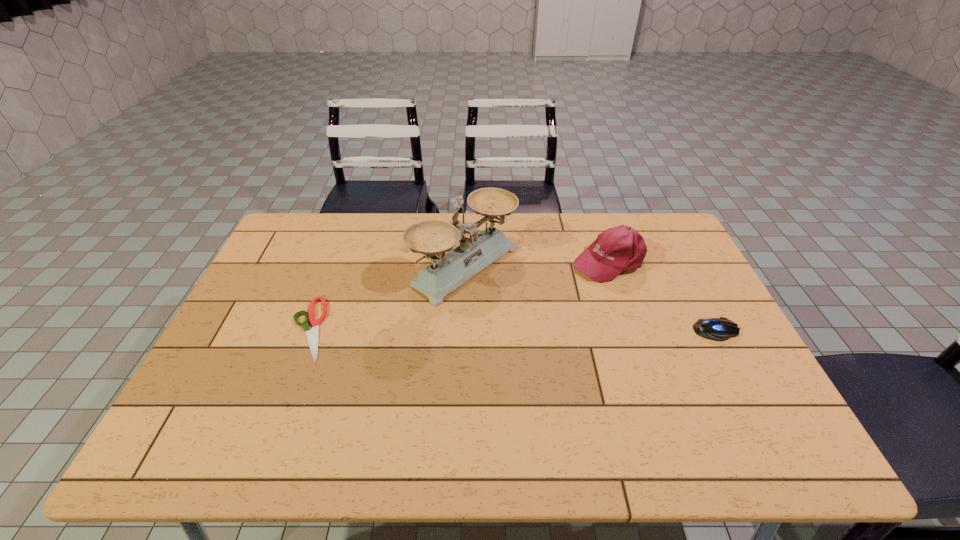
Locate an element on the screen. This screenshot has height=540, width=960. free spot that satisfies the following two spatial constraints: 1. on the front side of the scale; 2. on the button side of the rightmost object is located at coordinates (465, 330).

You are a GUI agent. You are given a task and a screenshot of the screen. Output one action in this format:
    pyautogui.click(x=<x>, y=<y>)
    Task: Click on the free location that satisfies the following two spatial constraints: 1. on the back side of the leftmost object; 2. on the right side of the third shortest object
    
    Given the screenshot: What is the action you would take?
    pyautogui.click(x=335, y=260)

Where is `free space that satisfies the following two spatial constraints: 1. on the front side of the rightmost object; 2. on the button side of the scale`? free space that satisfies the following two spatial constraints: 1. on the front side of the rightmost object; 2. on the button side of the scale is located at coordinates (465, 330).

You are a GUI agent. You are given a task and a screenshot of the screen. Output one action in this format:
    pyautogui.click(x=<x>, y=<y>)
    Task: Click on the vacant area that satisfies the following two spatial constraints: 1. on the front side of the baseball cap; 2. on the button side of the computer mouse
    The height and width of the screenshot is (540, 960).
    Given the screenshot: What is the action you would take?
    [631, 330]

Where is `vacant space that satisfies the following two spatial constraints: 1. on the front side of the scissors; 2. on the button side of the third tallest object`? This screenshot has height=540, width=960. vacant space that satisfies the following two spatial constraints: 1. on the front side of the scissors; 2. on the button side of the third tallest object is located at coordinates (308, 330).

This screenshot has width=960, height=540. In order to click on free space in the image that satisfies the following two spatial constraints: 1. on the front side of the rightmost object; 2. on the button side of the shortest object in this screenshot , I will do `click(308, 330)`.